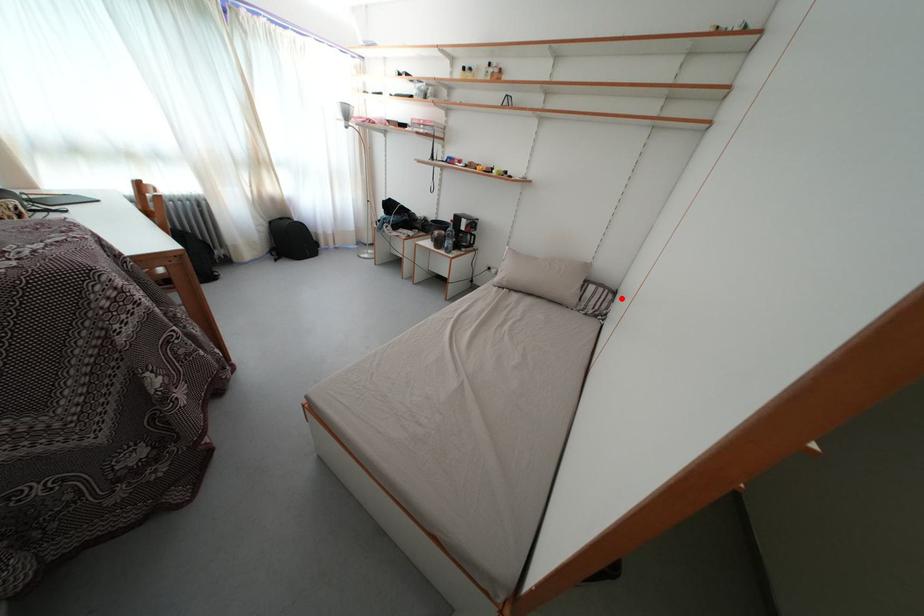
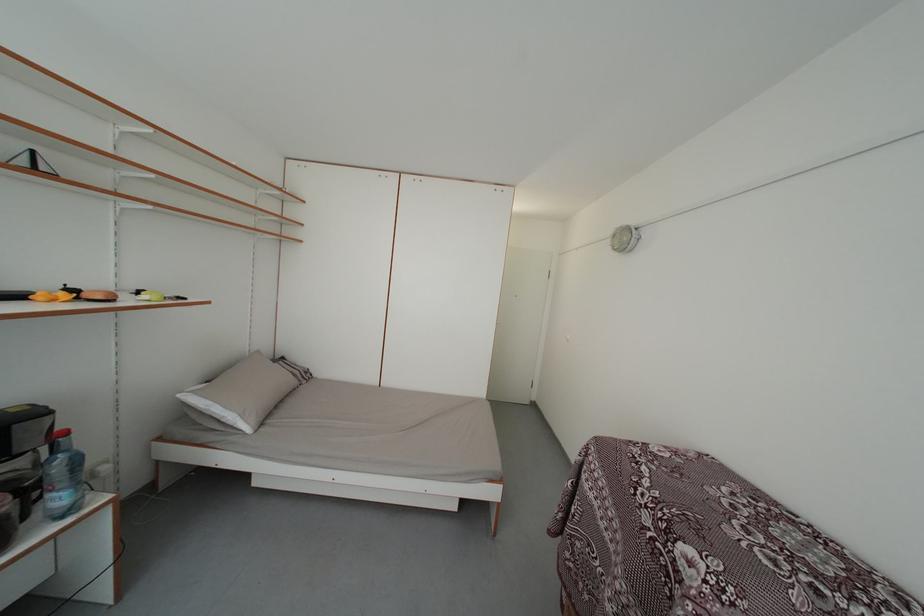
Where in the second image is the point corresponding to the highlighted location from the first image?

(289, 365)